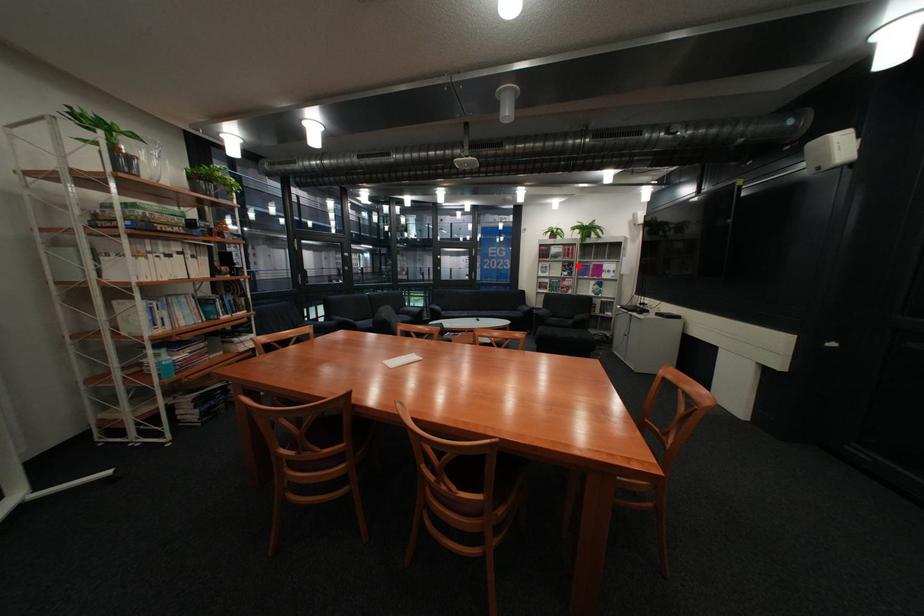
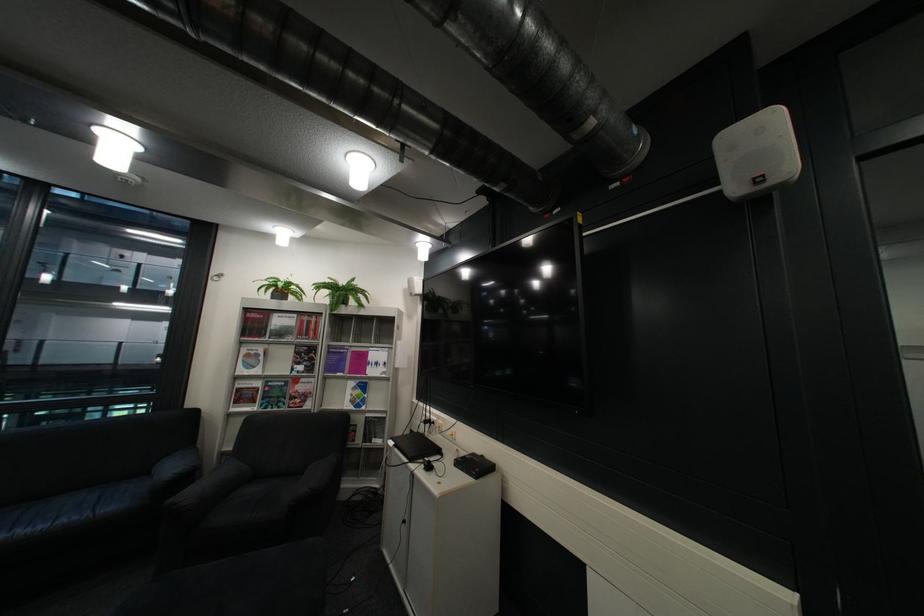
Locate, in the second image, the point that corresponds to the highlighted location in the first image.

(311, 353)